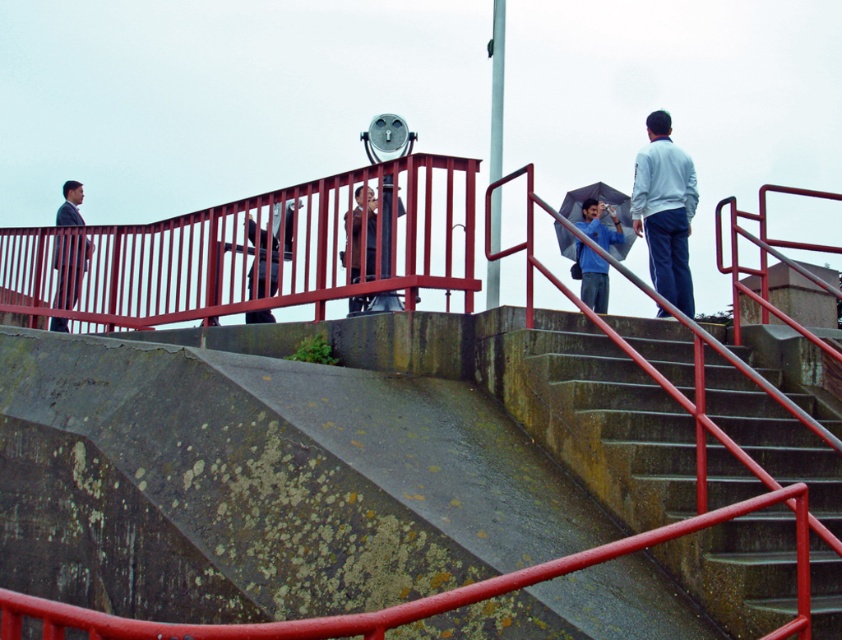
You are planning to walk down the concrete stairs at center while carrying the blue fabric umbrella at upper right. Will the umbrella fit comfortably without needing to adjust its position as you descend?

The concrete stairs at center is wider than the blue fabric umbrella at upper right, so the umbrella will fit comfortably without needing adjustment.

You are standing at the entrance of the concrete structure and want to go down to the lower level. Which direction should you go to find the concrete stairs at center?

The concrete stairs at center is located at point (605, 420), so you should move towards the center area to find them.